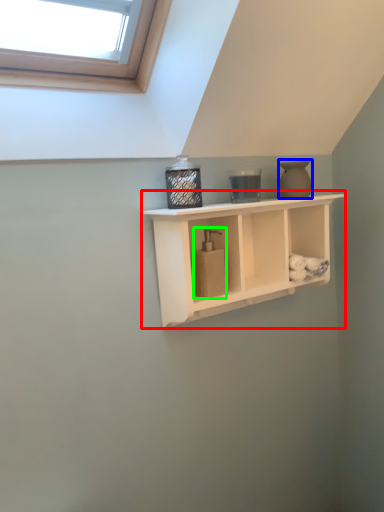
Question: Based on their relative distances, which object is nearer to shelf (highlighted by a red box)? Choose from vase (highlighted by a blue box) and soap dispenser (highlighted by a green box).

Choices:
 (A) vase
 (B) soap dispenser

Answer: (B)